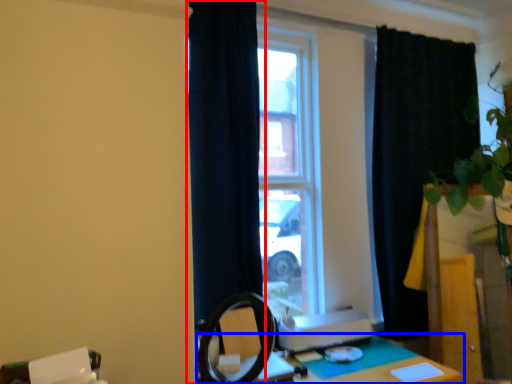
Question: Which point is further to the camera, curtain (highlighted by a red box) or table (highlighted by a blue box)?

Choices:
 (A) curtain
 (B) table

Answer: (A)